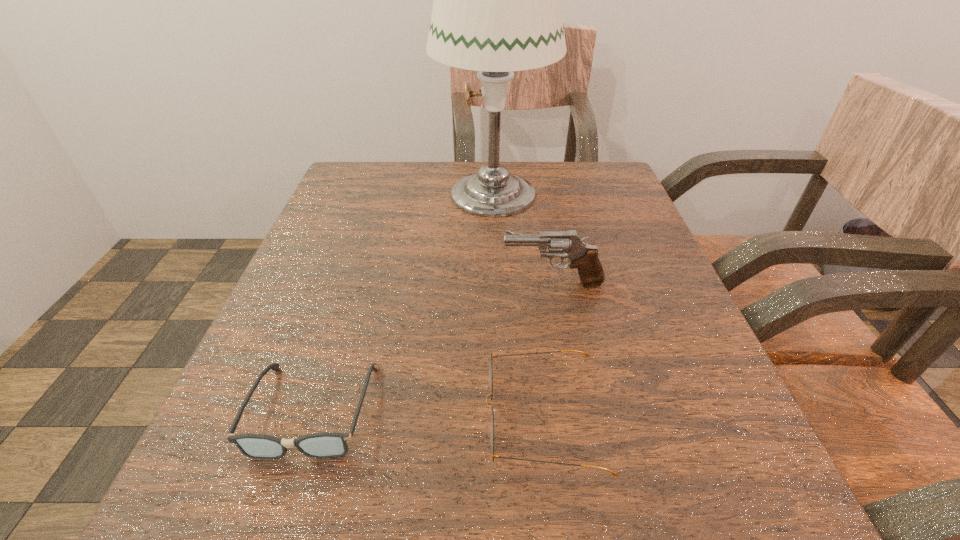
Locate an element on the screen. object at the right edge is located at coordinates (565, 244).

What are the coordinates of `object that is positioned at the near left corner` in the screenshot? It's located at (321, 445).

In the image, there is a desktop. Where is `vacant space at the far edge`? This screenshot has width=960, height=540. vacant space at the far edge is located at coordinates (458, 173).

Find the location of a particular element. This screenshot has width=960, height=540. vacant space at the near edge of the desktop is located at coordinates (490, 532).

Locate an element on the screen. Image resolution: width=960 pixels, height=540 pixels. vacant space at the left edge of the desktop is located at coordinates (284, 326).

Find the location of a particular element. This screenshot has width=960, height=540. vacant space at the right edge of the desktop is located at coordinates (670, 303).

The width and height of the screenshot is (960, 540). I want to click on vacant space at the far left corner of the desktop, so pyautogui.click(x=397, y=194).

Locate an element on the screen. The image size is (960, 540). vacant area at the far right corner is located at coordinates (582, 177).

I want to click on empty space that is in between the shortest object and the second shortest object, so 428,414.

Identify the location of free spot between the right spectacles and the leftmost object. (428, 414).